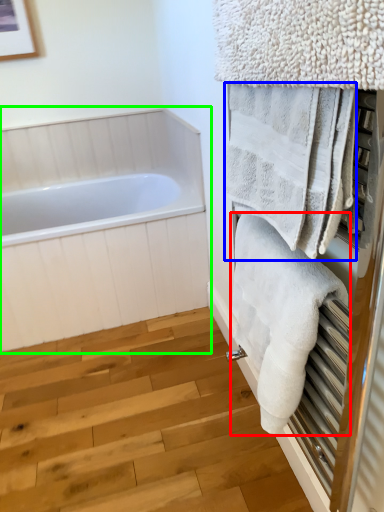
Question: Based on their relative distances, which object is farther from towel (highlighted by a red box)? Choose from towel (highlighted by a blue box) and bathtub (highlighted by a green box).

Choices:
 (A) towel
 (B) bathtub

Answer: (B)